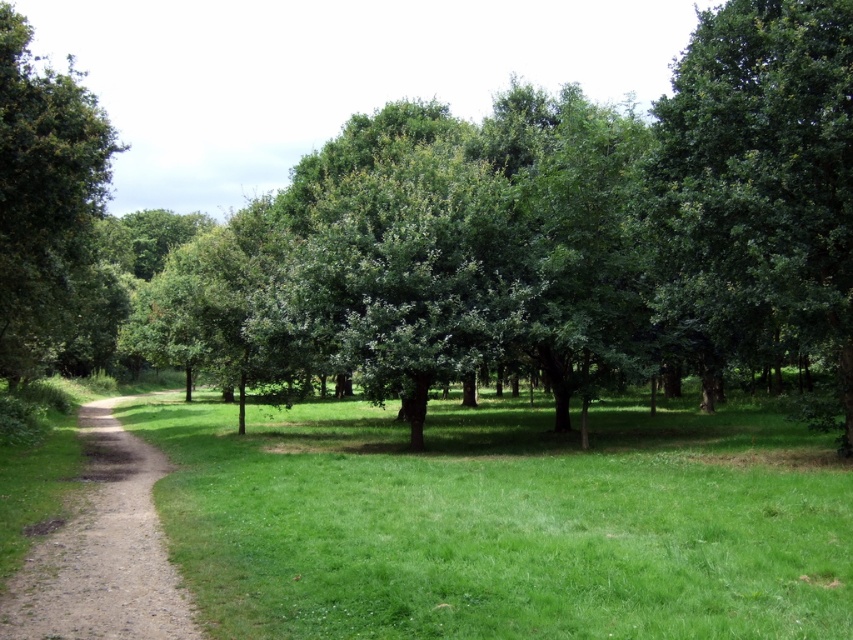
Question: Among these objects, which one is nearest to the camera?

Choices:
 (A) green grassy field at center
 (B) green leafy tree at center
 (C) dirt/gravel path at left

Answer: (A)

Question: Is green leafy tree at left positioned before dirt/gravel path at left?

Choices:
 (A) yes
 (B) no

Answer: (B)

Question: From the image, what is the correct spatial relationship of green leafy tree at center in relation to green leafy tree at right?

Choices:
 (A) right
 (B) left

Answer: (B)

Question: Does green grassy field at center appear under green leafy tree at right?

Choices:
 (A) no
 (B) yes

Answer: (B)

Question: Estimate the real-world distances between objects in this image. Which object is closer to the green leafy tree at center?

Choices:
 (A) green leafy tree at right
 (B) green leafy tree at left

Answer: (B)

Question: Which of these objects is positioned closest to the green leafy tree at left?

Choices:
 (A) dirt/gravel path at left
 (B) green leafy tree at right
 (C) green leafy tree at center

Answer: (C)